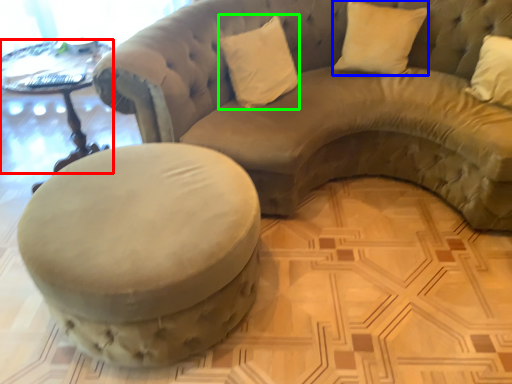
Question: Which is nearer to the table (highlighted by a red box)? pillow (highlighted by a blue box) or pillow (highlighted by a green box).

Choices:
 (A) pillow
 (B) pillow

Answer: (B)